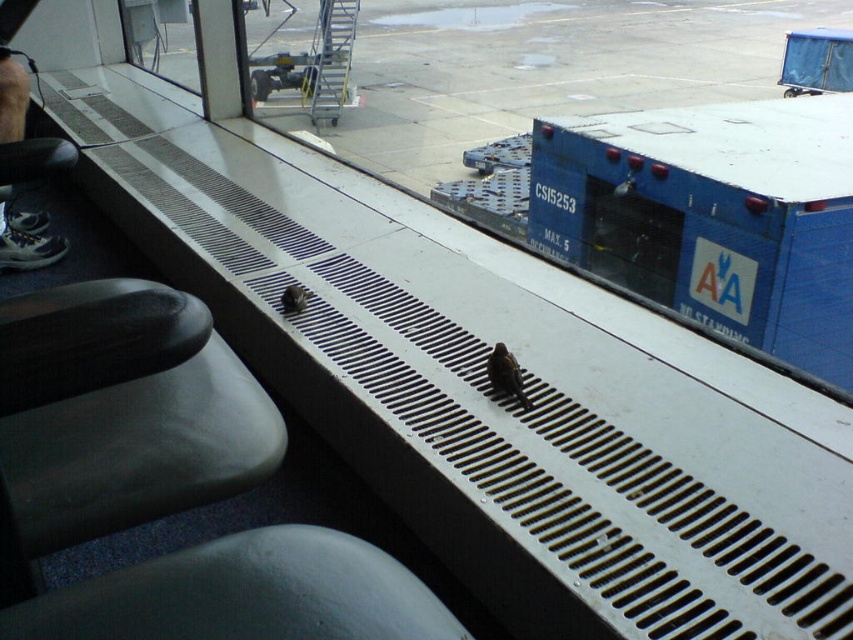
You are standing at the point marked as point (634, 193) and want to walk to the window ledge where the birds are perched. Which direction should you move to reach the window ledge first, considering the point marked as point (251, 545) is in front of your current position?

Since point (251, 545) is in front of point (634, 193), you should move towards the direction of point (251, 545) to reach the window ledge where the birds are perched first.